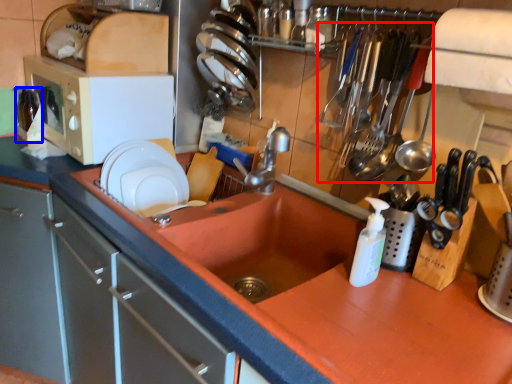
Question: Which of the following is the closest to the observer, silverware (highlighted by a red box) or bottle (highlighted by a blue box)?

Choices:
 (A) silverware
 (B) bottle

Answer: (A)